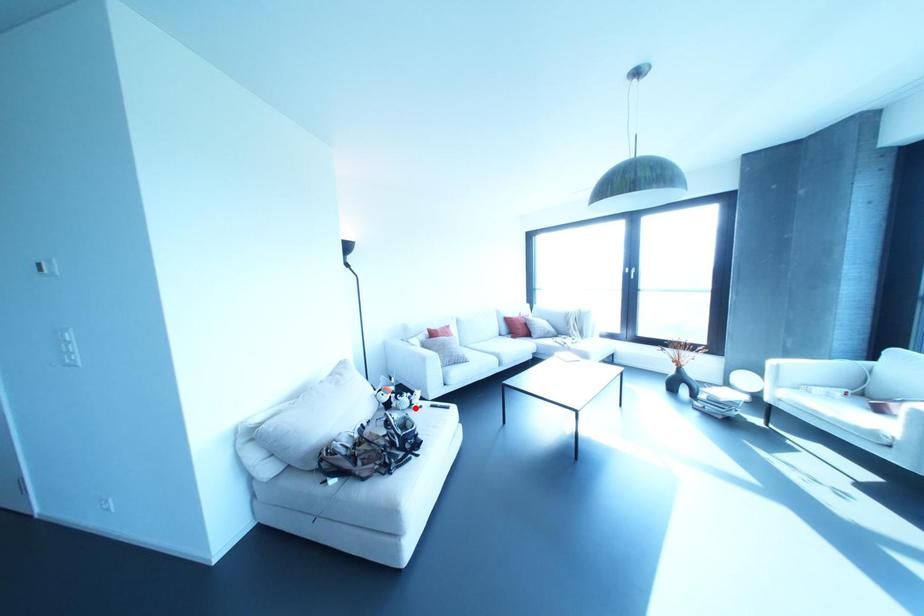
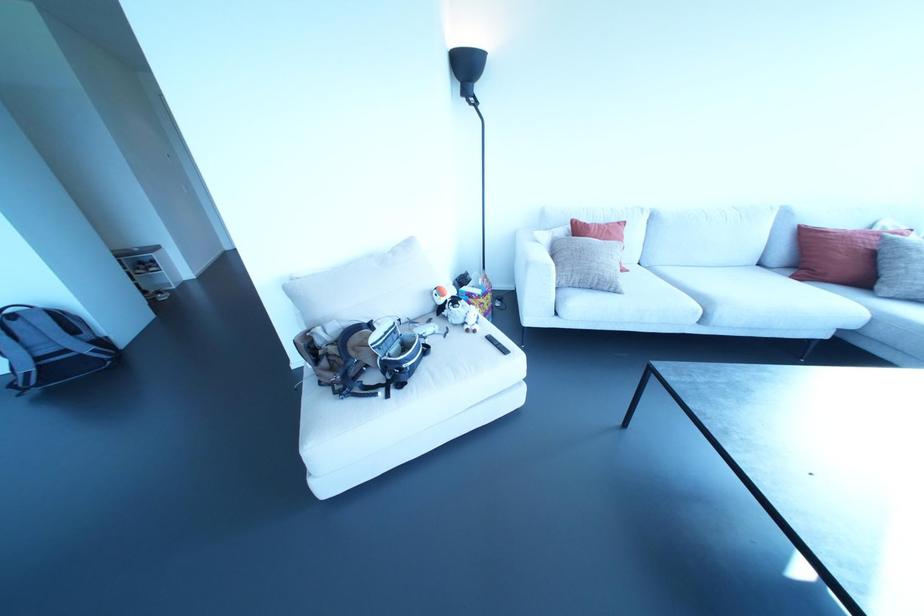
Question: I am providing you with two images of the same scene from different viewpoints. Given a red point in image1, look at the same physical point in image2. Is it:

Choices:
 (A) Closer to the viewpoint
 (B) Farther from the viewpoint

Answer: (B)